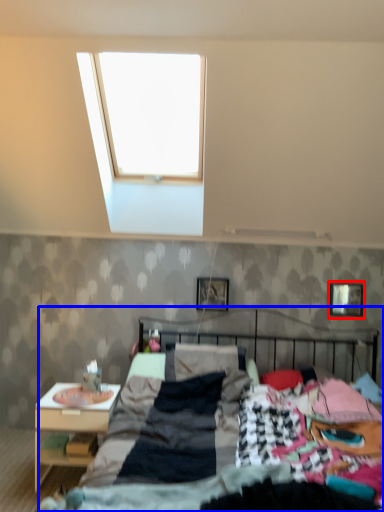
Question: Which point is further to the camera, picture frame (highlighted by a red box) or bed (highlighted by a blue box)?

Choices:
 (A) picture frame
 (B) bed

Answer: (A)